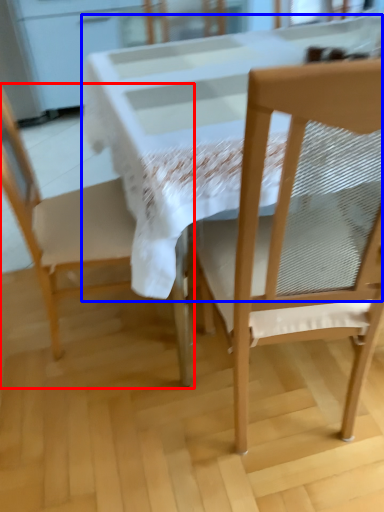
Question: Which of the following is the closest to the observer, chair (highlighted by a red box) or round table (highlighted by a blue box)?

Choices:
 (A) chair
 (B) round table

Answer: (B)